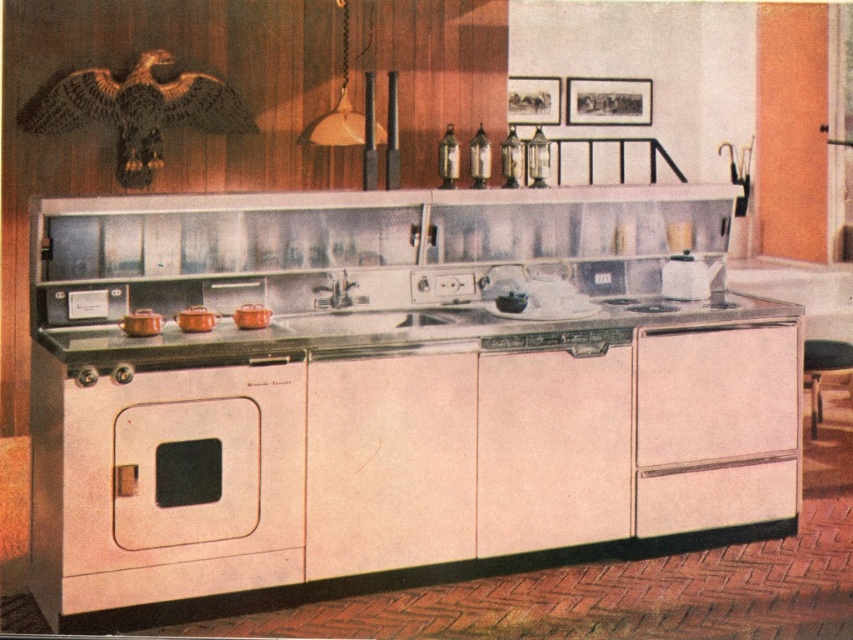
You are a chef preparing a large meal and need to place a 1.2 meter long platter on the metallic silver counter top at center. Considering the golden metallic eagle at upper left is also on the counter, can you fit the platter without moving the eagle?

The metallic silver counter top at center is wider than the golden metallic eagle at upper left, so the platter can be placed on the counter next to the eagle without moving it.

You are a chef preparing a meal in the vintage kitchen. You have a metallic silver counter top at center and a golden metallic eagle at upper left. Which object would provide more space for arranging ingredients?

The metallic silver counter top at center has a larger size compared to the golden metallic eagle at upper left, so it would provide more space for arranging ingredients.